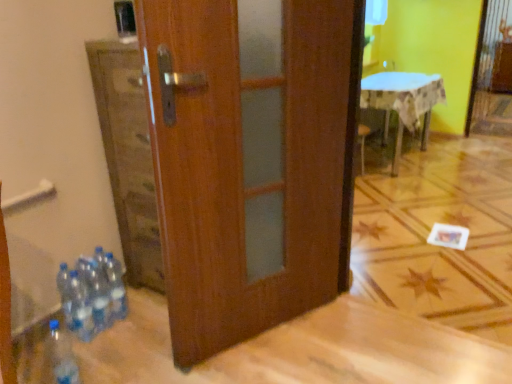
Image resolution: width=512 pixels, height=384 pixels. Describe the element at coordinates (100, 292) in the screenshot. I see `clear plastic bottles at lower left, which appears as the second bottle when viewed from the back` at that location.

Locate an element on the screen. The width and height of the screenshot is (512, 384). clear plastic bottle at lower left, the 1th bottle viewed from the front is located at coordinates (62, 355).

I want to click on clear plastic bottles at lower left, which appears as the second bottle when viewed from the front, so click(80, 308).

Find the location of a particular element. This screenshot has width=512, height=384. clear plastic bottles at lower left, positioned as the 3th bottle in front-to-back order is located at coordinates (100, 292).

Is white cloth-covered table at upper right thinner than clear plastic bottles at lower left, which appears as the second bottle when viewed from the front?

In fact, white cloth-covered table at upper right might be wider than clear plastic bottles at lower left, which appears as the second bottle when viewed from the front.

From a real-world perspective, is white cloth-covered table at upper right under clear plastic bottles at lower left, the 3th bottle positioned from the back?

No, from a real-world perspective, white cloth-covered table at upper right is not under clear plastic bottles at lower left, the 3th bottle positioned from the back.

Is point (434, 81) closer or farther from the camera than point (89, 319)?

Point (434, 81) appears to be farther away from the viewer than point (89, 319).

Does white cloth-covered table at upper right contain clear plastic bottles at lower left, which appears as the second bottle when viewed from the front?

No, clear plastic bottles at lower left, which appears as the second bottle when viewed from the front, is not inside white cloth-covered table at upper right.

Starting from the white cloth-covered table at upper right, which bottle is the 1st one in front? Please provide its 2D coordinates.

[(115, 286)]

Measure the distance from white cloth-covered table at upper right to clear plastic bottles at lower left, which is the 4th bottle from front to back.

The distance of white cloth-covered table at upper right from clear plastic bottles at lower left, which is the 4th bottle from front to back, is 2.63 meters.

Can you see white cloth-covered table at upper right touching clear plastic bottles at lower left, acting as the 1th bottle starting from the back?

white cloth-covered table at upper right and clear plastic bottles at lower left, acting as the 1th bottle starting from the back, are clearly separated.

Is white cloth-covered table at upper right taller than clear plastic bottles at lower left, which is the 4th bottle from front to back?

Indeed, white cloth-covered table at upper right has a greater height compared to clear plastic bottles at lower left, which is the 4th bottle from front to back.

From a real-world perspective, starting from the clear plastic bottles at lower left, which appears as the second bottle when viewed from the back, which bottle is the 2nd one below it? Please provide its 2D coordinates.

[(80, 308)]

From a real-world perspective, is clear plastic bottles at lower left, positioned as the 3th bottle in front-to-back order, below clear plastic bottles at lower left, the 3th bottle positioned from the back?

No.

What's the angular difference between clear plastic bottles at lower left, which appears as the second bottle when viewed from the back, and clear plastic bottles at lower left, the 3th bottle positioned from the back,'s facing directions?

0.00102 degrees.

How far apart are clear plastic bottles at lower left, which appears as the second bottle when viewed from the back, and clear plastic bottles at lower left, which appears as the second bottle when viewed from the front?

clear plastic bottles at lower left, which appears as the second bottle when viewed from the back, is 5.96 centimeters from clear plastic bottles at lower left, which appears as the second bottle when viewed from the front.

From the image's perspective, count 1st bottles downward from the clear plastic bottles at lower left, which is the 4th bottle from front to back, and point to it. Please provide its 2D coordinates.

[(100, 292)]

From a real-world perspective, between clear plastic bottles at lower left, which appears as the second bottle when viewed from the back, and clear plastic bottles at lower left, acting as the 1th bottle starting from the back, who is vertically lower?

clear plastic bottles at lower left, acting as the 1th bottle starting from the back, from a real-world perspective.

Is clear plastic bottles at lower left, which appears as the second bottle when viewed from the back, facing towards clear plastic bottles at lower left, acting as the 1th bottle starting from the back?

No, clear plastic bottles at lower left, which appears as the second bottle when viewed from the back, is not aimed at clear plastic bottles at lower left, acting as the 1th bottle starting from the back.

From a real-world perspective, is clear plastic bottles at lower left, which is the 4th bottle from front to back, positioned under clear plastic bottles at lower left, positioned as the 3th bottle in front-to-back order, based on gravity?

Correct, in the physical world, clear plastic bottles at lower left, which is the 4th bottle from front to back, is lower than clear plastic bottles at lower left, positioned as the 3th bottle in front-to-back order.

From the picture: Can you see clear plastic bottles at lower left, which is the 4th bottle from front to back, touching clear plastic bottles at lower left, positioned as the 3th bottle in front-to-back order?

Yes.

Does clear plastic bottles at lower left, which is the 4th bottle from front to back, have a lesser width compared to clear plastic bottles at lower left, positioned as the 3th bottle in front-to-back order?

No, clear plastic bottles at lower left, which is the 4th bottle from front to back, is not thinner than clear plastic bottles at lower left, positioned as the 3th bottle in front-to-back order.

From the image's perspective, between white cloth-covered table at upper right and clear plastic bottles at lower left, which appears as the second bottle when viewed from the back, who is located below?

From the image's view, clear plastic bottles at lower left, which appears as the second bottle when viewed from the back, is below.

Where is `the 3rd bottle counting from the left of the white cloth-covered table at upper right`? The image size is (512, 384). the 3rd bottle counting from the left of the white cloth-covered table at upper right is located at coordinates (100, 292).

Is point (377, 80) closer or farther from the camera than point (106, 312)?

Point (377, 80) is positioned farther from the camera compared to point (106, 312).

Is white cloth-covered table at upper right to the right of clear plastic bottles at lower left, which appears as the second bottle when viewed from the back, from the viewer's perspective?

Indeed, white cloth-covered table at upper right is positioned on the right side of clear plastic bottles at lower left, which appears as the second bottle when viewed from the back.

In the scene shown: Considering the sizes of clear plastic bottles at lower left, acting as the 1th bottle starting from the back, and clear plastic bottles at lower left, which appears as the second bottle when viewed from the front, in the image, is clear plastic bottles at lower left, acting as the 1th bottle starting from the back, bigger or smaller than clear plastic bottles at lower left, which appears as the second bottle when viewed from the front,?

In the image, clear plastic bottles at lower left, acting as the 1th bottle starting from the back, appears to be larger than clear plastic bottles at lower left, which appears as the second bottle when viewed from the front.

From a real-world perspective, who is located lower, clear plastic bottles at lower left, acting as the 1th bottle starting from the back, or clear plastic bottles at lower left, the 3th bottle positioned from the back?

clear plastic bottles at lower left, the 3th bottle positioned from the back, is physically lower.

The width and height of the screenshot is (512, 384). What are the coordinates of `table on the right of clear plastic bottles at lower left, the 3th bottle positioned from the back` in the screenshot? It's located at (403, 103).

Locate an element on the screen. bottle that is the 1st one when counting leftward from the white cloth-covered table at upper right is located at coordinates (115, 286).

When comparing their distances from clear plastic bottles at lower left, acting as the 1th bottle starting from the back, does clear plastic bottles at lower left, which appears as the second bottle when viewed from the back, or clear plastic bottle at lower left, the 1th bottle viewed from the front, seem closer?

Based on the image, clear plastic bottles at lower left, which appears as the second bottle when viewed from the back, appears to be nearer to clear plastic bottles at lower left, acting as the 1th bottle starting from the back.

From the image, which object appears to be farther from clear plastic bottle at lower left, the 1th bottle viewed from the front, clear plastic bottles at lower left, the 3th bottle positioned from the back, or clear plastic bottles at lower left, which appears as the second bottle when viewed from the back?

Among the two, clear plastic bottles at lower left, which appears as the second bottle when viewed from the back, is located further to clear plastic bottle at lower left, the 1th bottle viewed from the front.

Consider the image. Estimate the real-world distances between objects in this image. Which object is further from clear plastic bottles at lower left, positioned as the 3th bottle in front-to-back order, clear plastic bottles at lower left, the 3th bottle positioned from the back, or clear plastic bottle at lower left, which ranks as the 4th bottle in back-to-front order?

Based on the image, clear plastic bottle at lower left, which ranks as the 4th bottle in back-to-front order, appears to be further to clear plastic bottles at lower left, positioned as the 3th bottle in front-to-back order.

Considering their positions, is white cloth-covered table at upper right positioned further to clear plastic bottles at lower left, which appears as the second bottle when viewed from the back, than clear plastic bottles at lower left, which appears as the second bottle when viewed from the front?

white cloth-covered table at upper right lies further to clear plastic bottles at lower left, which appears as the second bottle when viewed from the back, than the other object.

Which object lies nearer to the anchor point clear plastic bottles at lower left, which is the 4th bottle from front to back, clear plastic bottles at lower left, which appears as the second bottle when viewed from the front, or clear plastic bottle at lower left, the 1th bottle viewed from the front?

Based on the image, clear plastic bottles at lower left, which appears as the second bottle when viewed from the front, appears to be nearer to clear plastic bottles at lower left, which is the 4th bottle from front to back.

From the image, which object appears to be farther from clear plastic bottles at lower left, which appears as the second bottle when viewed from the front, clear plastic bottles at lower left, which appears as the second bottle when viewed from the back, or white cloth-covered table at upper right?

white cloth-covered table at upper right lies further to clear plastic bottles at lower left, which appears as the second bottle when viewed from the front, than the other object.

Considering their positions, is clear plastic bottles at lower left, the 3th bottle positioned from the back, positioned further to clear plastic bottles at lower left, which is the 4th bottle from front to back, than clear plastic bottles at lower left, positioned as the 3th bottle in front-to-back order?

clear plastic bottles at lower left, the 3th bottle positioned from the back, is further to clear plastic bottles at lower left, which is the 4th bottle from front to back.

From the image, which object appears to be farther from clear plastic bottles at lower left, acting as the 1th bottle starting from the back, white cloth-covered table at upper right or clear plastic bottles at lower left, the 3th bottle positioned from the back?

white cloth-covered table at upper right.

Locate an element on the screen. The height and width of the screenshot is (384, 512). bottle positioned between clear plastic bottles at lower left, which appears as the second bottle when viewed from the front, and clear plastic bottles at lower left, which is the 4th bottle from front to back, from near to far is located at coordinates pyautogui.click(x=100, y=292).

Identify the location of bottle positioned between clear plastic bottle at lower left, the 1th bottle viewed from the front, and clear plastic bottles at lower left, which appears as the second bottle when viewed from the back, from near to far. The width and height of the screenshot is (512, 384). (80, 308).

Locate an element on the screen. bottle between clear plastic bottle at lower left, which ranks as the 4th bottle in back-to-front order, and white cloth-covered table at upper right from left to right is located at coordinates (115, 286).